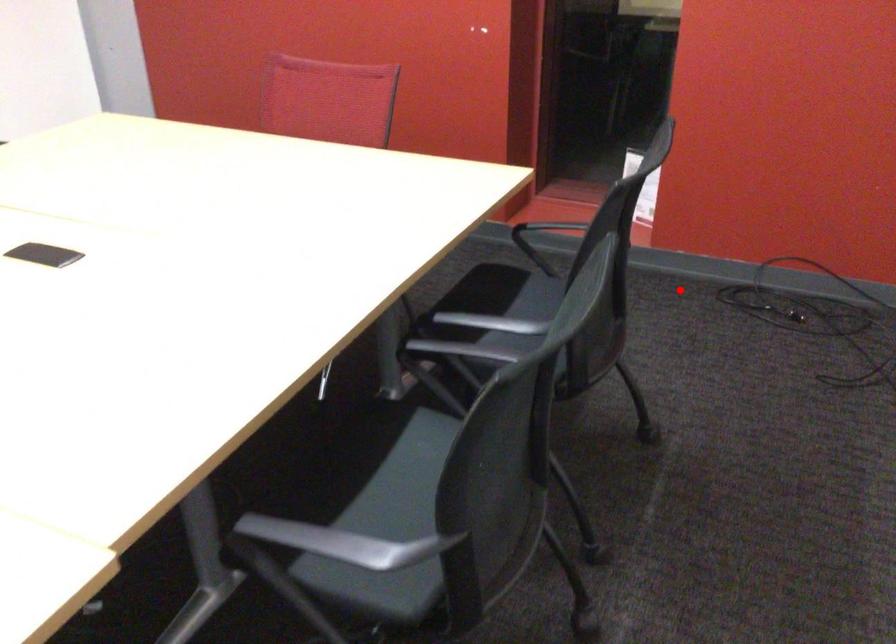
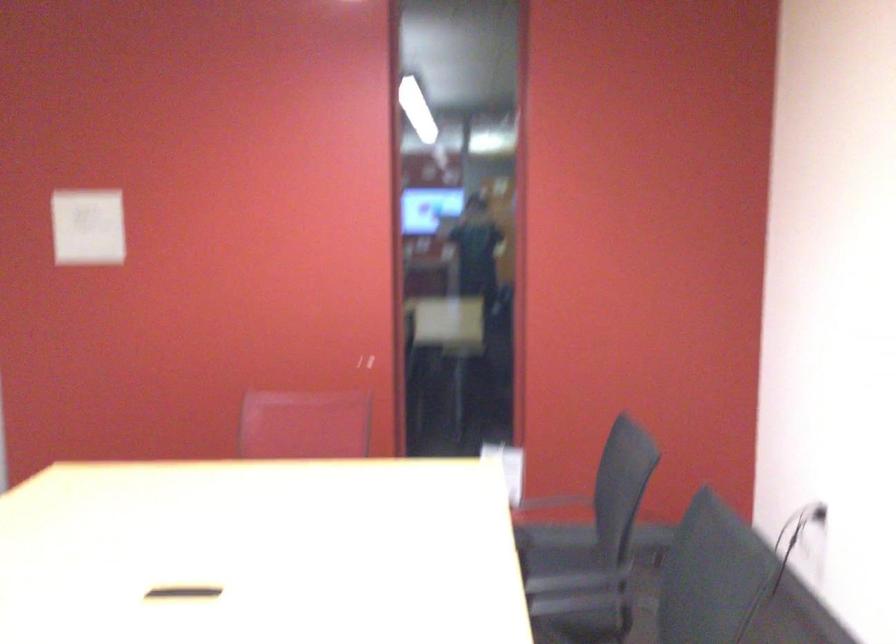
Question: I am providing you with two images of the same scene from different viewpoints. A red point is shown in image1. For the corresponding object point in image2, is it positioned nearer or farther from the camera?

Choices:
 (A) Nearer
 (B) Farther

Answer: (B)